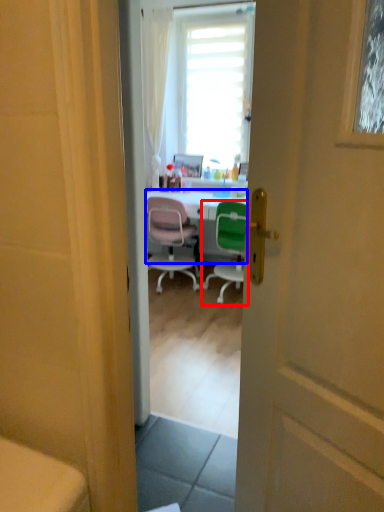
Question: Which point is further to the camera, chair (highlighted by a red box) or desk (highlighted by a blue box)?

Choices:
 (A) chair
 (B) desk

Answer: (B)